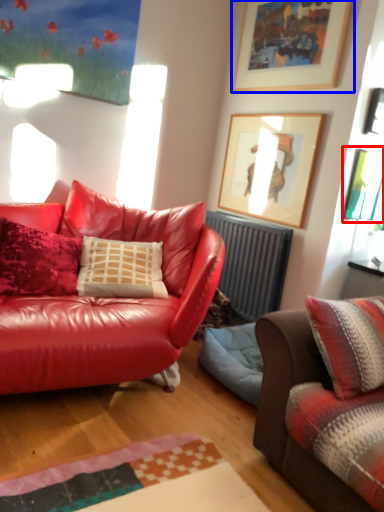
Question: Which of the following is the closest to the observer, picture frame (highlighted by a red box) or picture frame (highlighted by a blue box)?

Choices:
 (A) picture frame
 (B) picture frame

Answer: (B)